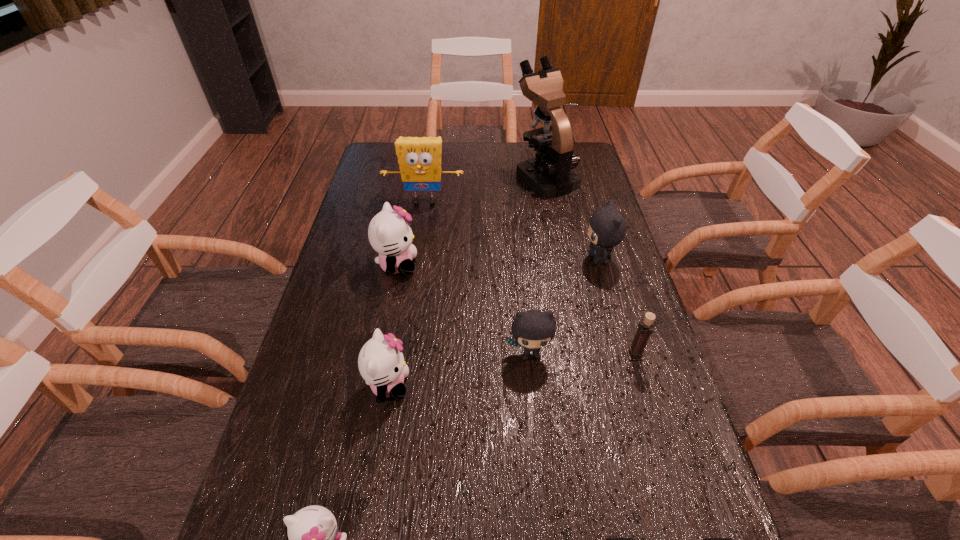
This screenshot has height=540, width=960. What are the coordinates of `vacant space located on the front of the tallest object` in the screenshot? It's located at (559, 243).

This screenshot has height=540, width=960. I want to click on free space located 0.350m on the face of the eighth shortest object, so click(x=412, y=285).

Where is `vacant space situated on the front-facing side of the biggest white kitten`? vacant space situated on the front-facing side of the biggest white kitten is located at coordinates (448, 265).

Locate an element on the screen. Image resolution: width=960 pixels, height=540 pixels. vacant space located on the front-facing side of the right gray kitten is located at coordinates (510, 259).

Where is `free space located on the front-facing side of the right gray kitten`? free space located on the front-facing side of the right gray kitten is located at coordinates (522, 259).

The image size is (960, 540). In order to click on blank space located on the front-facing side of the right gray kitten in this screenshot , I will do `click(536, 259)`.

At what (x,y) coordinates should I click in order to perform the action: click on free space located on the back of the candle holder. Please return your answer as a coordinate pair (x, y). Looking at the image, I should click on (615, 291).

Where is `free region located 0.110m on the front-facing side of the second farthest white kitten`? free region located 0.110m on the front-facing side of the second farthest white kitten is located at coordinates (457, 385).

Locate an element on the screen. vacant space located on the front-facing side of the smaller gray kitten is located at coordinates (545, 505).

At what (x,y) coordinates should I click in order to perform the action: click on object at the far edge. Please return your answer as a coordinate pair (x, y). The image size is (960, 540). Looking at the image, I should click on (550, 174).